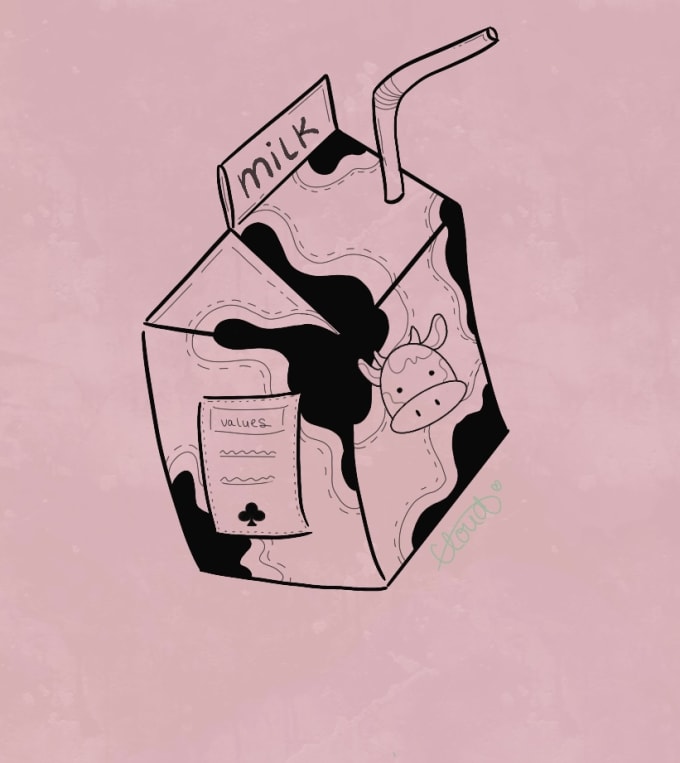
Where is `corner`? Image resolution: width=680 pixels, height=763 pixels. corner is located at coordinates (386, 581).